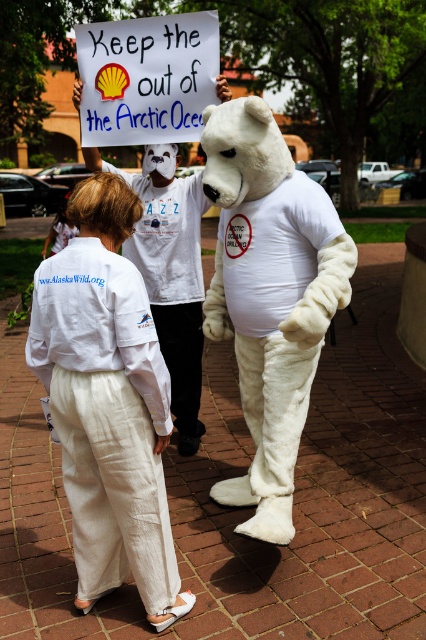
Question: Can you confirm if white furry bear at center is positioned to the left of white paper sign at upper center?

Choices:
 (A) yes
 (B) no

Answer: (B)

Question: Which object is closer to the camera taking this photo?

Choices:
 (A) white furry bear at center
 (B) white cotton pants at lower center
 (C) white linen pants at lower left
 (D) white paper sign at upper center

Answer: (C)

Question: Which object is farther from the camera taking this photo?

Choices:
 (A) white paper sign at upper center
 (B) white cotton pants at lower center

Answer: (A)

Question: Is white furry bear at center positioned behind white paper sign at upper center?

Choices:
 (A) no
 (B) yes

Answer: (A)

Question: Which point is farther to the camera?

Choices:
 (A) (262, 380)
 (B) (178, 220)
 (C) (138, 337)
 (D) (164, 61)

Answer: (D)

Question: Does white furry bear at center appear on the right side of white paper sign at upper center?

Choices:
 (A) yes
 (B) no

Answer: (A)